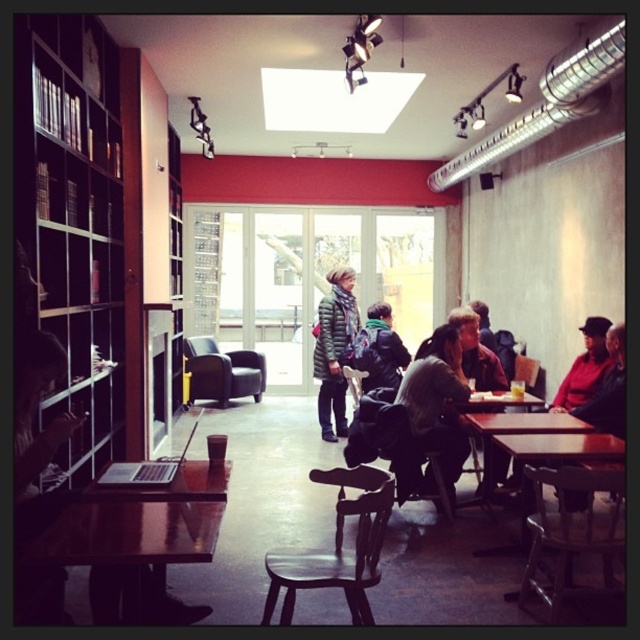
Question: Is green down jacket at center smaller than dark green textured jacket at center?

Choices:
 (A) no
 (B) yes

Answer: (A)

Question: Which of the following is the farthest from the observer?

Choices:
 (A) (584, 344)
 (B) (38, 116)
 (C) (356, 365)

Answer: (C)

Question: Is green down jacket at center bigger than wooden table at center?

Choices:
 (A) no
 (B) yes

Answer: (A)

Question: Is matte black laptop at left further to the viewer compared to dark green textured jacket at center?

Choices:
 (A) yes
 (B) no

Answer: (B)

Question: Among these objects, which one is nearest to the camera?

Choices:
 (A) wooden table at center
 (B) wooden bookshelf at left
 (C) wooden table at lower left

Answer: (C)

Question: Which point is closer to the camera?

Choices:
 (A) (42, 621)
 (B) (582, 392)
 (C) (484, 432)
 (D) (365, 380)

Answer: (A)